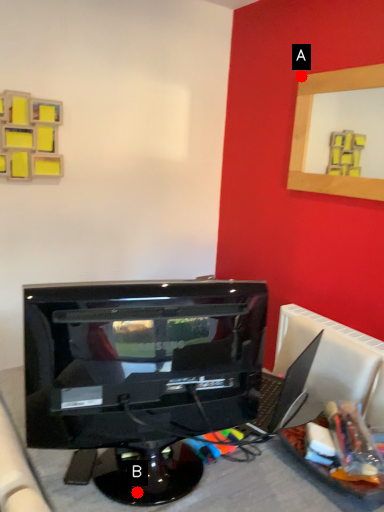
Question: Two points are circled on the image, labeled by A and B beside each circle. Which point is closer to the camera?

Choices:
 (A) A is closer
 (B) B is closer

Answer: (B)